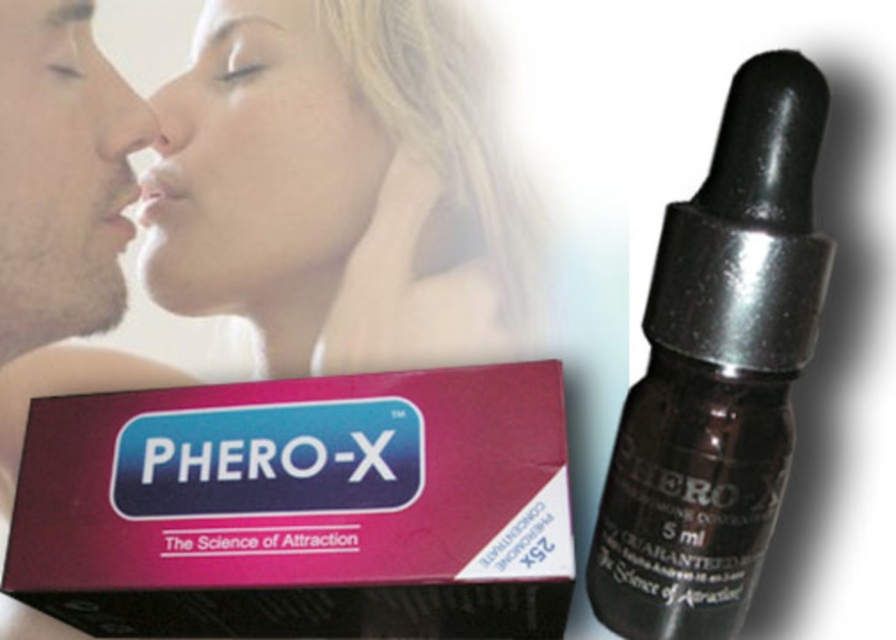
You are a customer in a store holding the product box and want to use both the transparent glass dropper at center and the matte pink lipstick at center. Which one requires more space in your hand due to its size?

The transparent glass dropper at center is larger in size than the matte pink lipstick at center, so it requires more space in your hand.